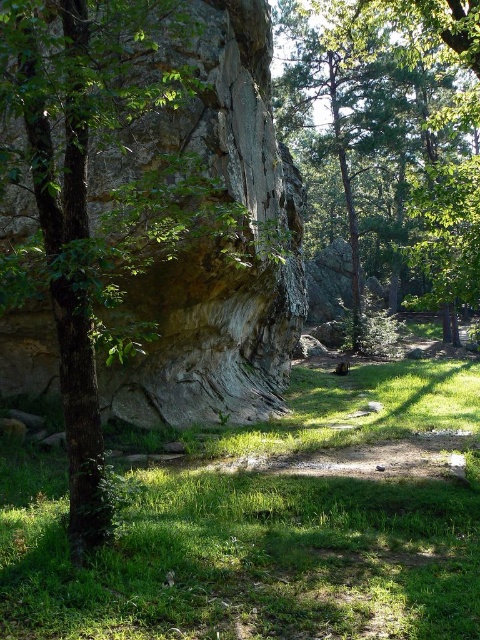
Question: Can you confirm if rough stone rock face at center is positioned to the right of green leafy tree at center?

Choices:
 (A) yes
 (B) no

Answer: (B)

Question: Is green grassy at center to the left of rough stone rock face at center from the viewer's perspective?

Choices:
 (A) yes
 (B) no

Answer: (B)

Question: Which object appears farthest from the camera in this image?

Choices:
 (A) rough stone rock face at center
 (B) green leafy tree at center
 (C) green grassy at center

Answer: (B)

Question: Is green grassy at center below green leafy tree at center?

Choices:
 (A) no
 (B) yes

Answer: (B)

Question: Based on their relative distances, which object is nearer to the green grassy at center?

Choices:
 (A) green leafy tree at center
 (B) rough stone rock face at center

Answer: (B)

Question: Which object is closer to the camera taking this photo?

Choices:
 (A) rough stone rock face at center
 (B) green leafy tree at center

Answer: (A)